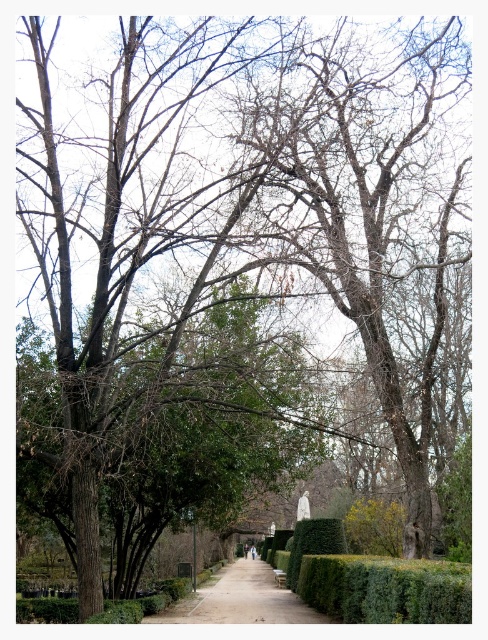
Question: Does green leafy hedge at center lie behind paved stone path at center?

Choices:
 (A) yes
 (B) no

Answer: (B)

Question: Is green leafy hedge at center positioned at the back of paved stone path at center?

Choices:
 (A) yes
 (B) no

Answer: (B)

Question: Which point is closer to the camera?

Choices:
 (A) (285, 588)
 (B) (438, 593)

Answer: (B)

Question: From the image, what is the correct spatial relationship of green leafy hedge at center in relation to paved stone path at center?

Choices:
 (A) below
 (B) above

Answer: (B)